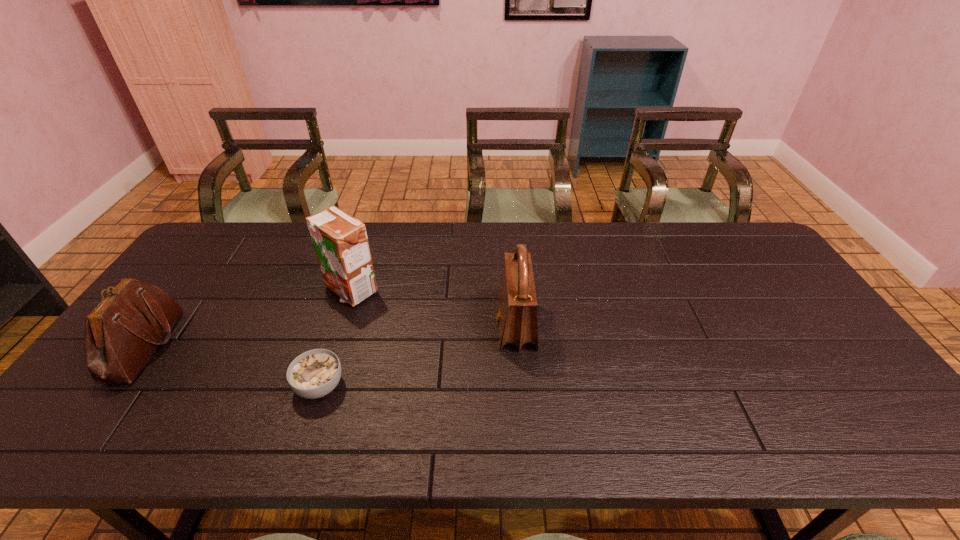
The image size is (960, 540). I want to click on the taller shoulder bag, so click(517, 301).

This screenshot has width=960, height=540. In order to click on the rightmost object in this screenshot , I will do `click(517, 301)`.

Find the location of `carton`. carton is located at coordinates (340, 241).

Where is `the shorter shoulder bag`? The width and height of the screenshot is (960, 540). the shorter shoulder bag is located at coordinates (122, 332).

In order to click on the second shortest object in this screenshot , I will do `click(122, 332)`.

Where is `soup bowl`? This screenshot has height=540, width=960. soup bowl is located at coordinates (315, 373).

I want to click on vacant space situated on the front flap of the right shoulder bag, so click(x=460, y=326).

The height and width of the screenshot is (540, 960). I want to click on free spot located 0.250m on the front flap of the right shoulder bag, so [406, 326].

Find the location of a particular element. The width and height of the screenshot is (960, 540). free space located 0.100m on the front flap of the right shoulder bag is located at coordinates (460, 326).

Identify the location of vacant space located 0.070m on the straw side of the carton. This screenshot has width=960, height=540. (339, 327).